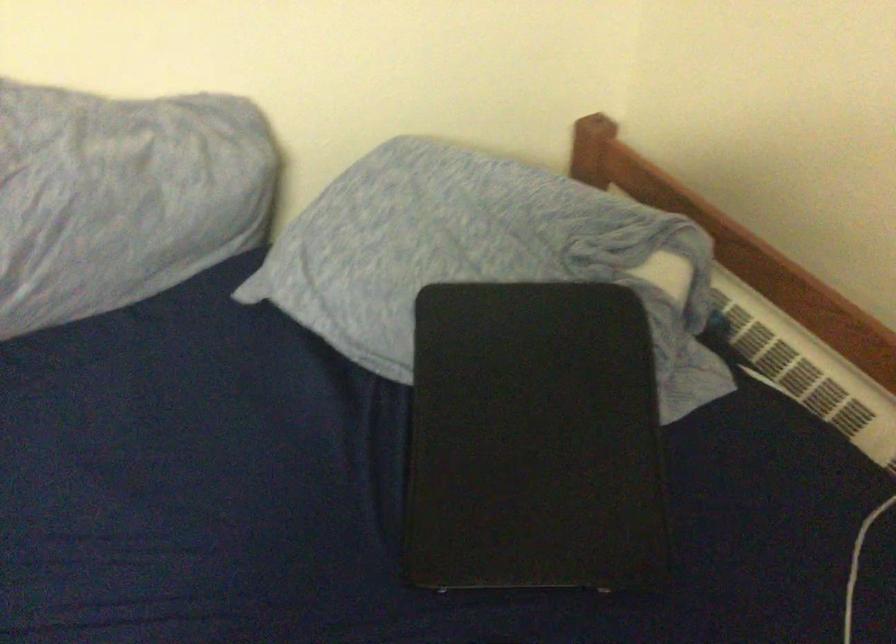
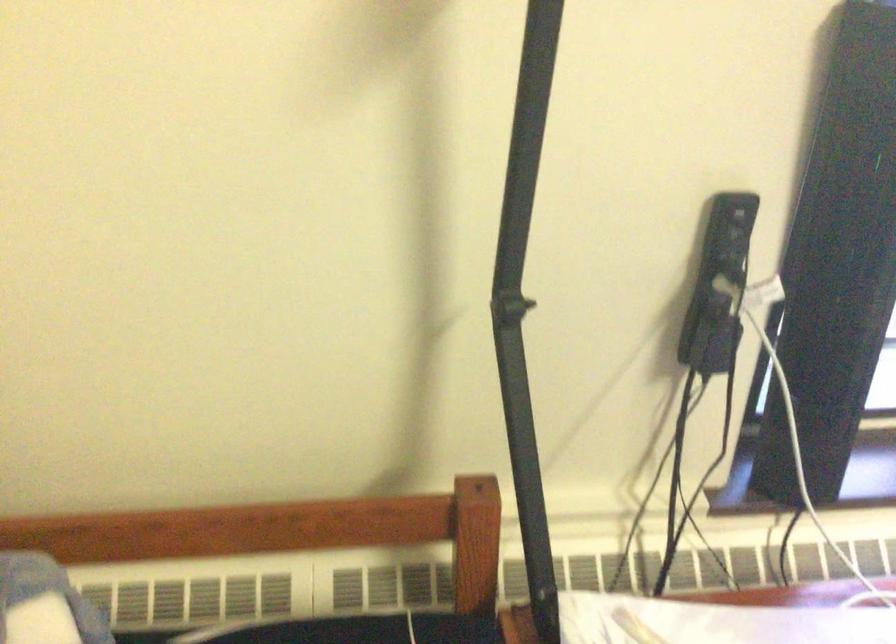
Question: The camera is either moving clockwise (left) or counter-clockwise (right) around the object. The first image is from the beginning of the video and the second image is from the end. Is the camera moving left or right when shooting the video?

Choices:
 (A) Left
 (B) Right

Answer: (A)